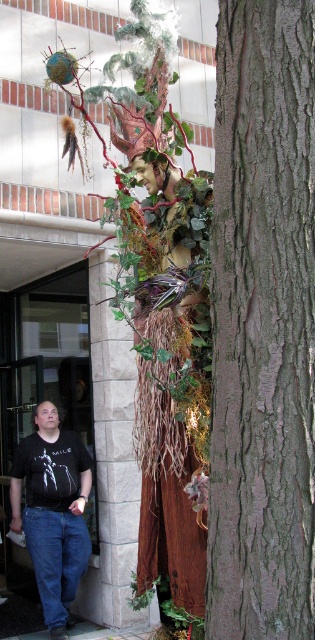
Does wooden statue at center have a greater width compared to black t-shirt at lower left?

Incorrect, wooden statue at center's width does not surpass black t-shirt at lower left's.

Is point (158, 321) positioned behind point (34, 460)?

That is False.

What do you see at coordinates (167, 348) in the screenshot? I see `wooden statue at center` at bounding box center [167, 348].

Find the location of `wooden statue at center`. wooden statue at center is located at coordinates (167, 348).

Does brown rough bark at right appear on the left side of wooden statue at center?

In fact, brown rough bark at right is to the right of wooden statue at center.

Between brown rough bark at right and wooden statue at center, which one has more height?

With more height is wooden statue at center.

Does point (233, 556) come farther from viewer compared to point (167, 332)?

No, it is not.

What are the coordinates of `brown rough bark at right` in the screenshot? It's located at (263, 324).

At what (x,y) coordinates should I click in order to perform the action: click on brown rough bark at right. Please return your answer as a coordinate pair (x, y). The width and height of the screenshot is (315, 640). Looking at the image, I should click on (263, 324).

Can you confirm if brown rough bark at right is thinner than black t-shirt at lower left?

Correct, brown rough bark at right's width is less than black t-shirt at lower left's.

What do you see at coordinates (263, 324) in the screenshot?
I see `brown rough bark at right` at bounding box center [263, 324].

What are the coordinates of `brown rough bark at right` in the screenshot? It's located at [263, 324].